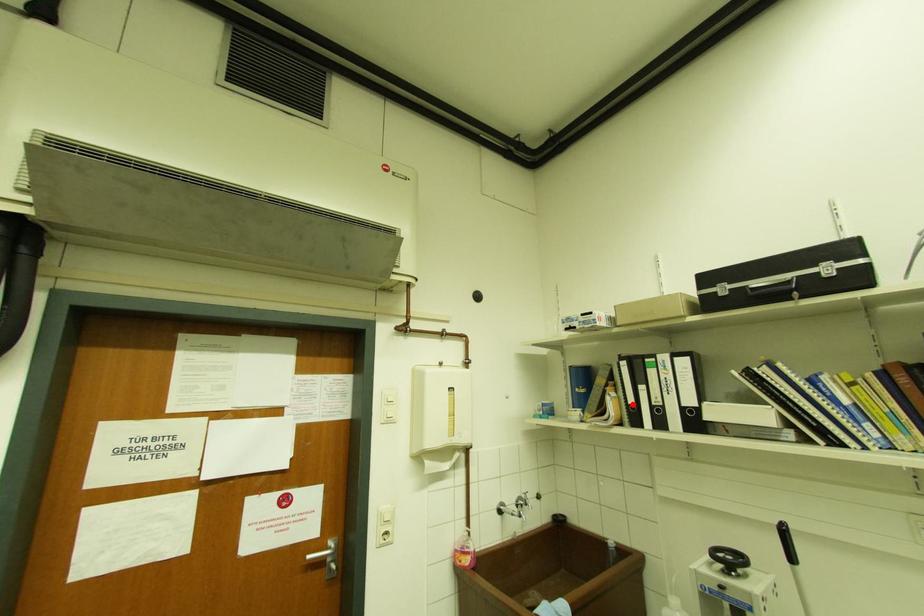
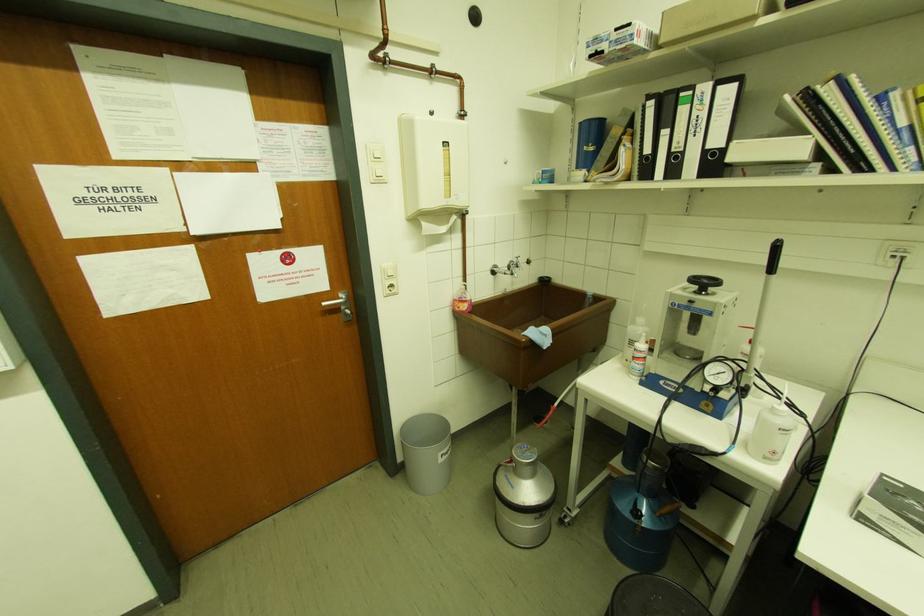
Question: I am providing you with two images of the same scene from different viewpoints. A red point is marked on the first image. At the location where the point appears in image 1, is it still visible in image 2?

Choices:
 (A) Yes
 (B) No

Answer: (A)